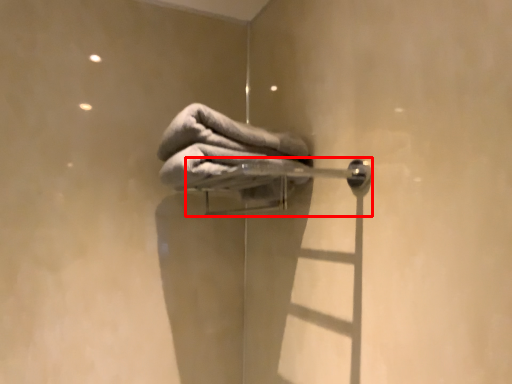
Question: In this image, where is door handle (annotated by the red box) located relative to towel?

Choices:
 (A) right
 (B) left

Answer: (A)